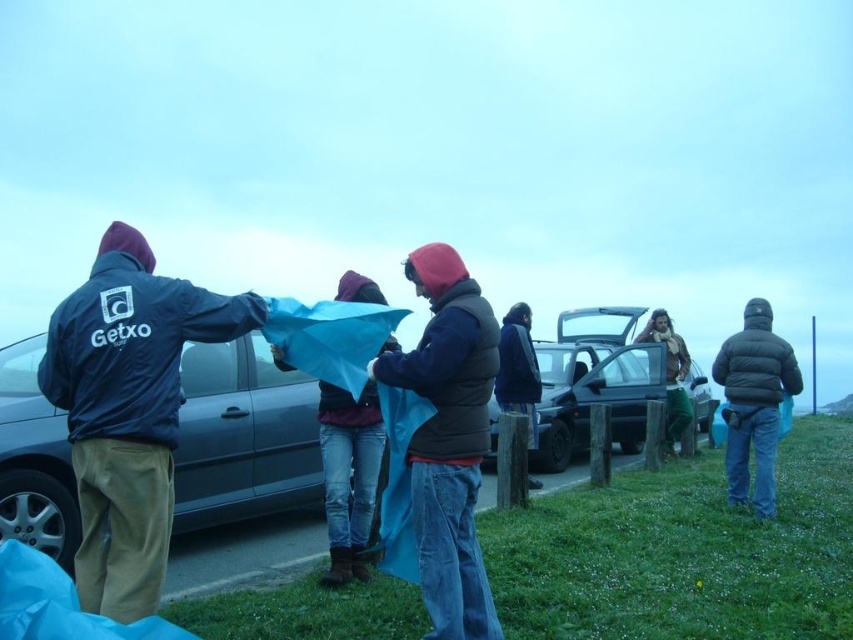
Is dark blue jacket at left positioned before dark blue puffy vest at center?

That is True.

Is dark blue jacket at left shorter than dark blue puffy vest at center?

Yes.

Measure the distance between point (158, 413) and camera.

The distance of point (158, 413) from camera is 3.10 meters.

Locate an element on the screen. This screenshot has height=640, width=853. dark blue jacket at left is located at coordinates (128, 410).

This screenshot has width=853, height=640. What do you see at coordinates (128, 410) in the screenshot? I see `dark blue jacket at left` at bounding box center [128, 410].

This screenshot has height=640, width=853. I want to click on dark blue jacket at left, so click(128, 410).

Who is positioned more to the left, blue fabric at center or dark blue jacket at center?

blue fabric at center

Does point (380, 465) come closer to viewer compared to point (508, 365)?

Yes, it is.

Identify the location of blue fabric at center. (349, 476).